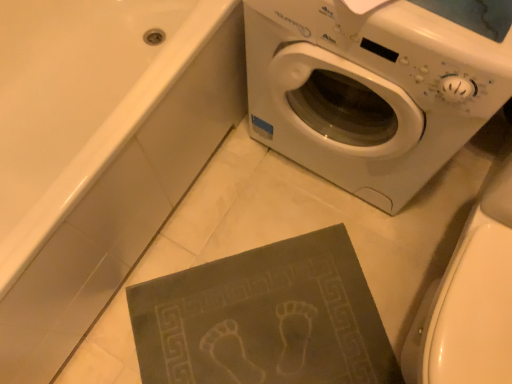
Question: From the image's perspective, is dark gray textured mat at lower center above white glossy toilet bowl at lower right?

Choices:
 (A) no
 (B) yes

Answer: (A)

Question: Is the position of dark gray textured mat at lower center less distant than that of white glossy toilet bowl at lower right?

Choices:
 (A) no
 (B) yes

Answer: (A)

Question: Can you confirm if dark gray textured mat at lower center is taller than white glossy toilet bowl at lower right?

Choices:
 (A) yes
 (B) no

Answer: (B)

Question: From a real-world perspective, is dark gray textured mat at lower center over white glossy toilet bowl at lower right?

Choices:
 (A) no
 (B) yes

Answer: (A)

Question: Could white glossy toilet bowl at lower right be considered to be inside dark gray textured mat at lower center?

Choices:
 (A) no
 (B) yes

Answer: (A)

Question: Is dark gray textured mat at lower center oriented away from white glossy toilet bowl at lower right?

Choices:
 (A) no
 (B) yes

Answer: (A)

Question: Is white plastic washing machine at upper right positioned before white glossy toilet bowl at lower right?

Choices:
 (A) yes
 (B) no

Answer: (B)

Question: Could white glossy toilet bowl at lower right be considered to be inside white plastic washing machine at upper right?

Choices:
 (A) no
 (B) yes

Answer: (A)

Question: Is white plastic washing machine at upper right touching white glossy toilet bowl at lower right?

Choices:
 (A) yes
 (B) no

Answer: (B)

Question: From the image's perspective, is white plastic washing machine at upper right below white glossy toilet bowl at lower right?

Choices:
 (A) no
 (B) yes

Answer: (A)

Question: Does white plastic washing machine at upper right have a larger size compared to white glossy toilet bowl at lower right?

Choices:
 (A) yes
 (B) no

Answer: (A)

Question: From a real-world perspective, is white plastic washing machine at upper right on top of white glossy toilet bowl at lower right?

Choices:
 (A) yes
 (B) no

Answer: (B)

Question: Is matte gray bath mat at lower center thinner than white plastic washing machine at upper right?

Choices:
 (A) yes
 (B) no

Answer: (B)